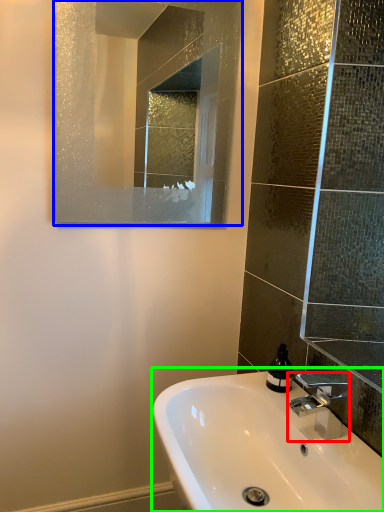
Question: Considering the real-world distances, which object is closest to tap (highlighted by a red box)? mirror (highlighted by a blue box) or sink (highlighted by a green box).

Choices:
 (A) mirror
 (B) sink

Answer: (B)